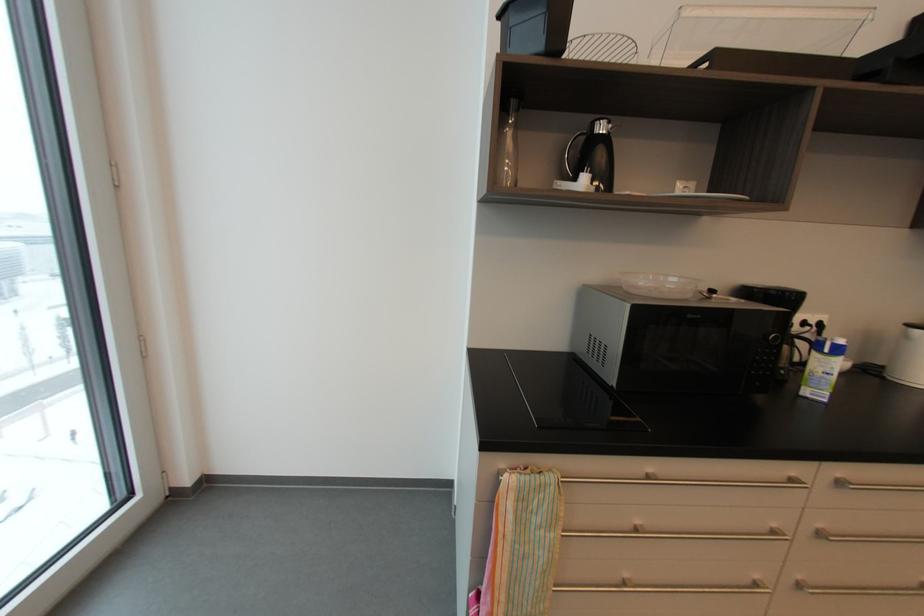
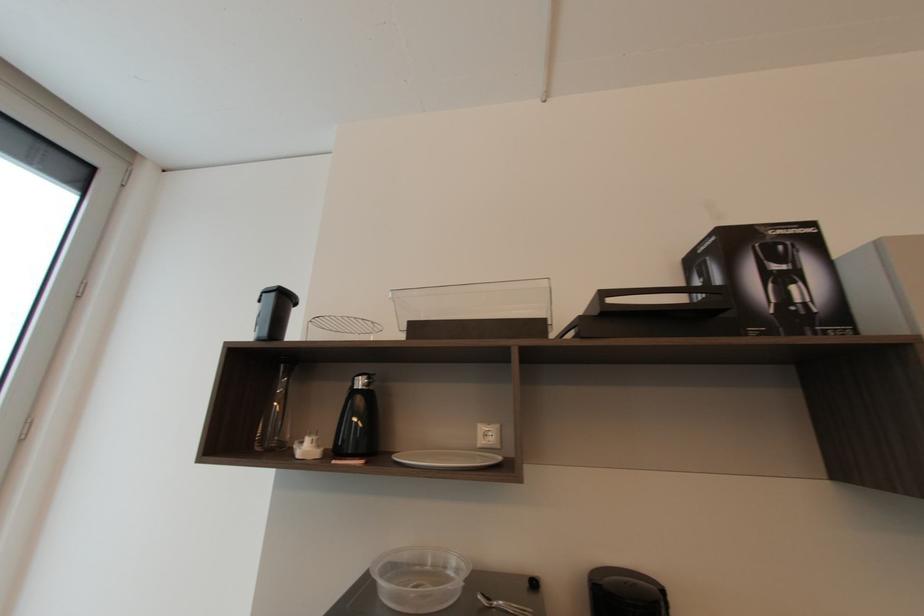
Locate, in the second image, the point that corresponds to the point at 603,128 in the first image.

(362, 384)